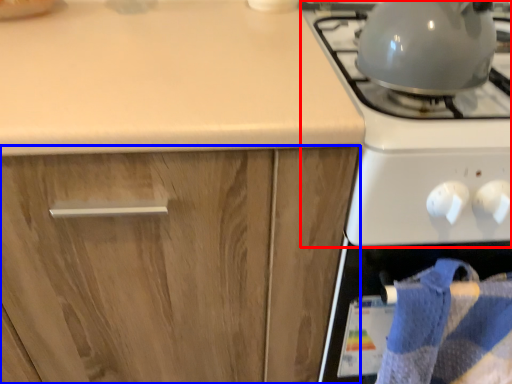
Question: Which of the following is the farthest to the observer, gas stove (highlighted by a red box) or cabinetry (highlighted by a blue box)?

Choices:
 (A) gas stove
 (B) cabinetry

Answer: (B)